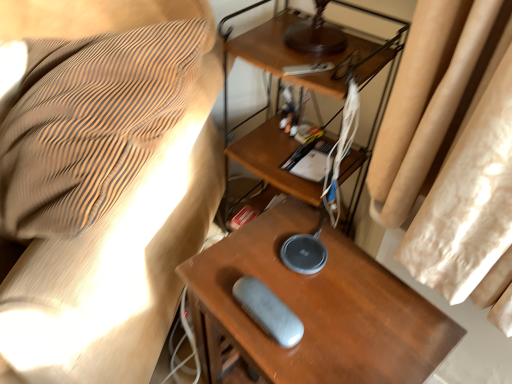
Image resolution: width=512 pixels, height=384 pixels. In order to click on free point above wooden table at center (from a real-world perspective) in this screenshot , I will do `click(325, 299)`.